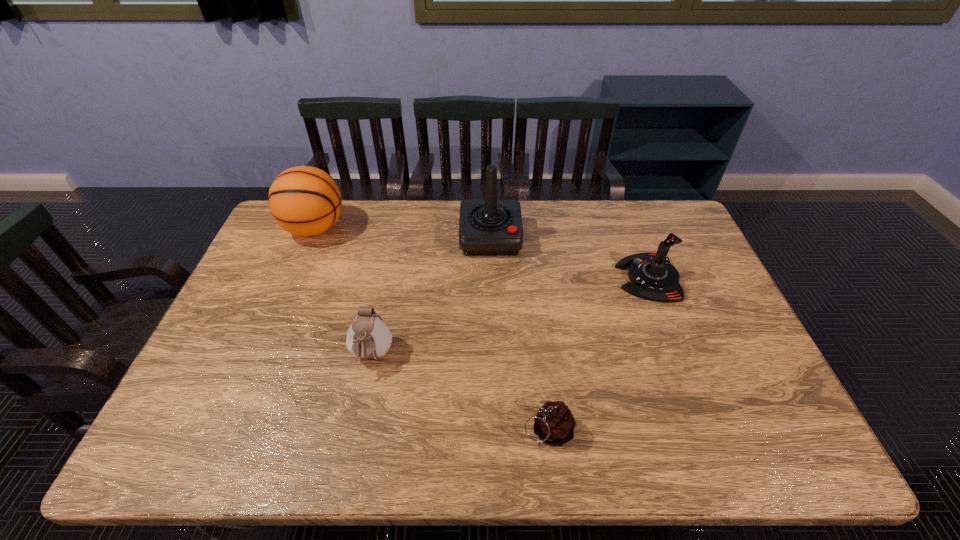
You are a GUI agent. You are given a task and a screenshot of the screen. Output one action in this format:
    pyautogui.click(x=<x>, y=<y>)
    Task: Click on the blank region between the taller joystick and the second nearest object
    The image size is (960, 540).
    Given the screenshot: What is the action you would take?
    pyautogui.click(x=431, y=297)

Locate an element on the screen. This screenshot has height=540, width=960. free space between the leftmost object and the taller joystick is located at coordinates (402, 233).

Identify the location of free space between the second nearest object and the tallest object. (431, 297).

The width and height of the screenshot is (960, 540). In order to click on vacant space that's between the rightmost object and the pouch in this screenshot , I will do `click(510, 317)`.

Image resolution: width=960 pixels, height=540 pixels. In order to click on vacant space that's between the pouch and the shortest object in this screenshot , I will do `click(460, 393)`.

Where is `vacant space that's between the leftmost object and the taller joystick`? The height and width of the screenshot is (540, 960). vacant space that's between the leftmost object and the taller joystick is located at coordinates (402, 233).

This screenshot has height=540, width=960. What are the coordinates of `vacant region between the left joystick and the leftmost object` in the screenshot? It's located at (402, 233).

The height and width of the screenshot is (540, 960). What are the coordinates of `vacant area that lies between the nearest object and the leftmost object` in the screenshot? It's located at coord(431,329).

At what (x,y) coordinates should I click in order to perform the action: click on vacant area that lies between the taller joystick and the fourth object from right to left. Please return your answer as a coordinate pair (x, y). This screenshot has width=960, height=540. Looking at the image, I should click on (431, 297).

Find the location of a particular element. This screenshot has width=960, height=540. object identified as the third closest to the pinecone is located at coordinates (490, 227).